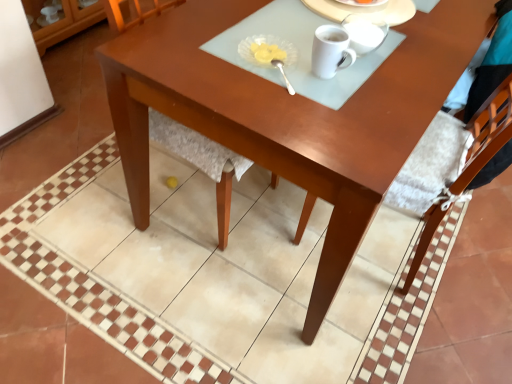
Where is `free location to the right of white glossy mug at upper center`? free location to the right of white glossy mug at upper center is located at coordinates coord(387,80).